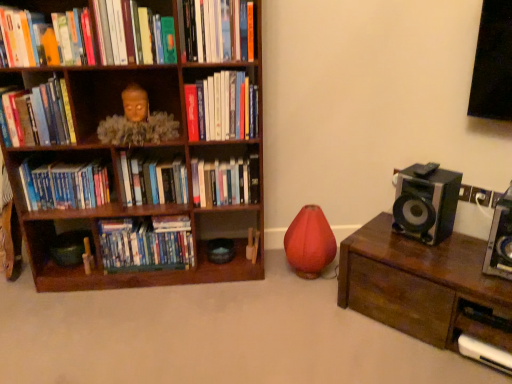
Locate an element on the screen. Image resolution: width=512 pixels, height=384 pixels. vacant space that is in between brown wooden bookcase at left and matte red vase at center is located at coordinates (232, 281).